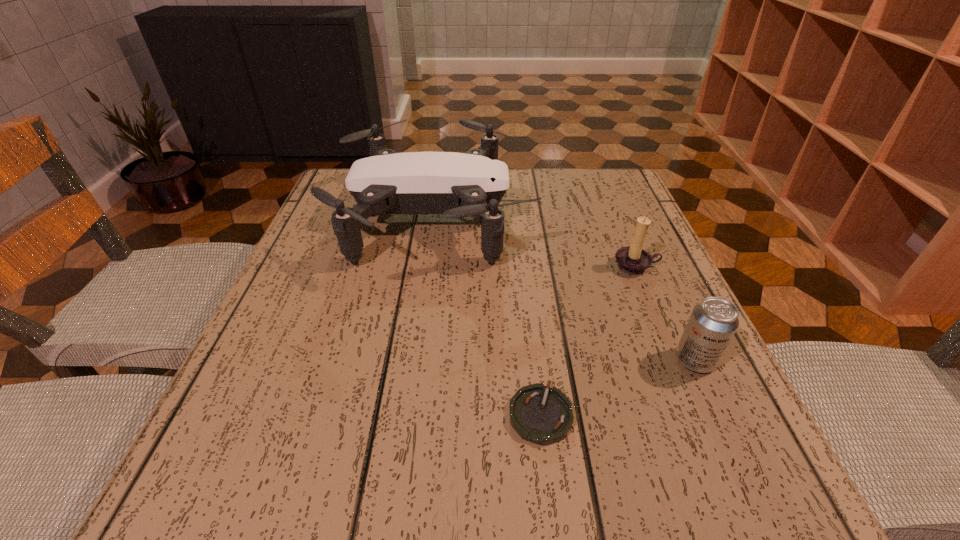
Locate an element on the screen. vacant space in between the nearest object and the beer can is located at coordinates (617, 387).

Identify the location of vacant area that lies between the candle holder and the second nearest object. (665, 313).

Find the location of `free space that is in between the candle holder and the nearest object`. free space that is in between the candle holder and the nearest object is located at coordinates [x=588, y=340].

This screenshot has height=540, width=960. What are the coordinates of `free space between the drone and the beer can` in the screenshot? It's located at (564, 289).

Image resolution: width=960 pixels, height=540 pixels. What are the coordinates of `vacant area between the drone and the ashtray` in the screenshot? It's located at (488, 316).

At what (x,y) coordinates should I click in order to perform the action: click on free space between the tallest object and the beer can. Please return your answer as a coordinate pair (x, y). Looking at the image, I should click on (564, 289).

Locate an element on the screen. free space between the tallest object and the candle holder is located at coordinates (536, 242).

This screenshot has width=960, height=540. Find the location of `vacant area that lies between the ashtray and the beer can`. vacant area that lies between the ashtray and the beer can is located at coordinates (617, 387).

Identify the location of empty space between the nearest object and the third farthest object. The width and height of the screenshot is (960, 540). (617, 387).

Locate which object is the closest to the candle holder. Please provide its 2D coordinates. Your answer should be formatted as a tuple, i.e. [(x, y)], where the tuple contains the x and y coordinates of a point satisfying the conditions above.

[(456, 185)]